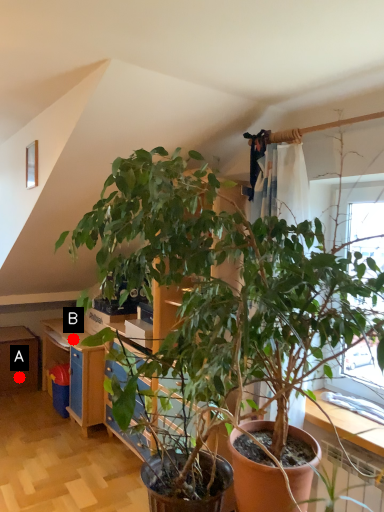
Question: Two points are circled on the image, labeled by A and B beside each circle. Which point appears farthest from the camera in this image?

Choices:
 (A) A is further
 (B) B is further

Answer: (A)